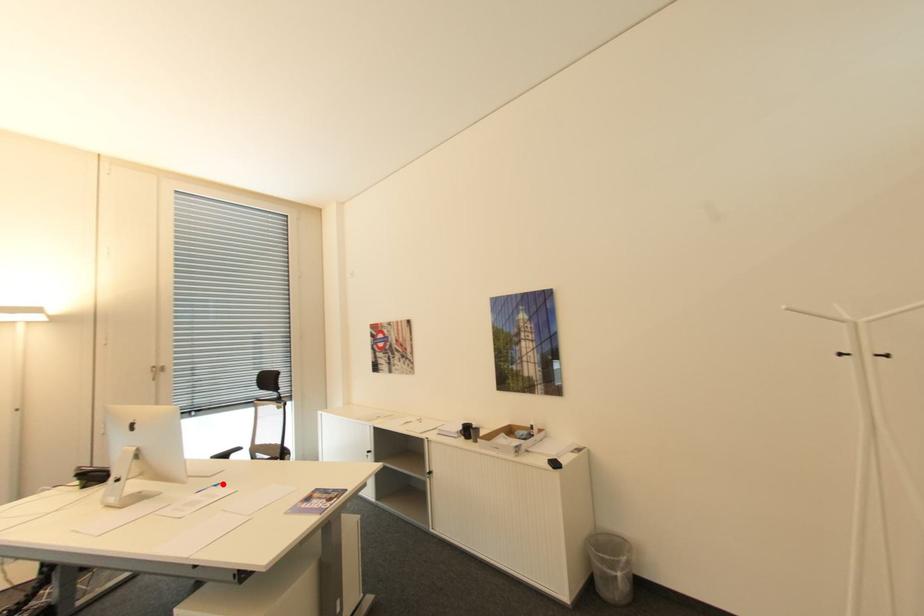
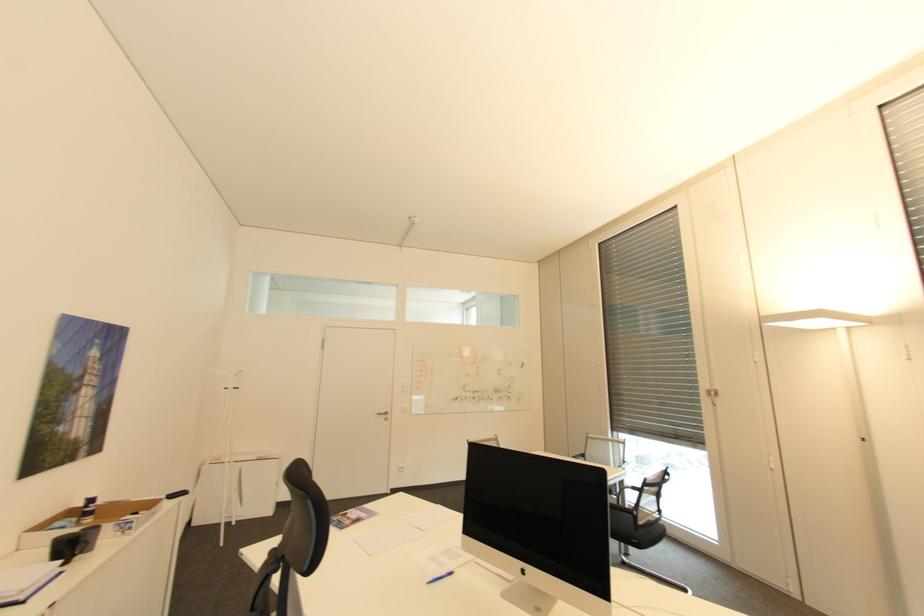
Where in the second image is the point corresponding to the highlighted location from the first image?

(434, 582)